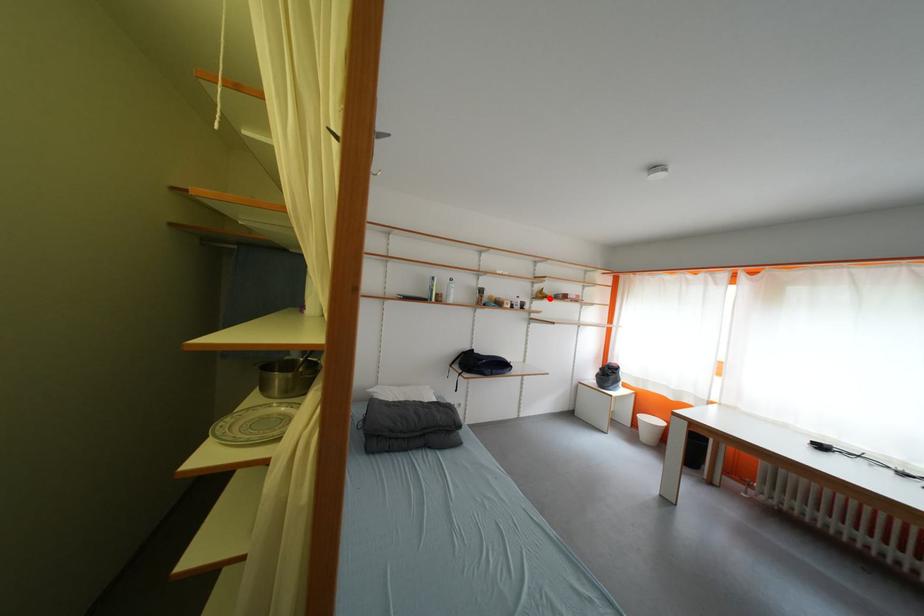
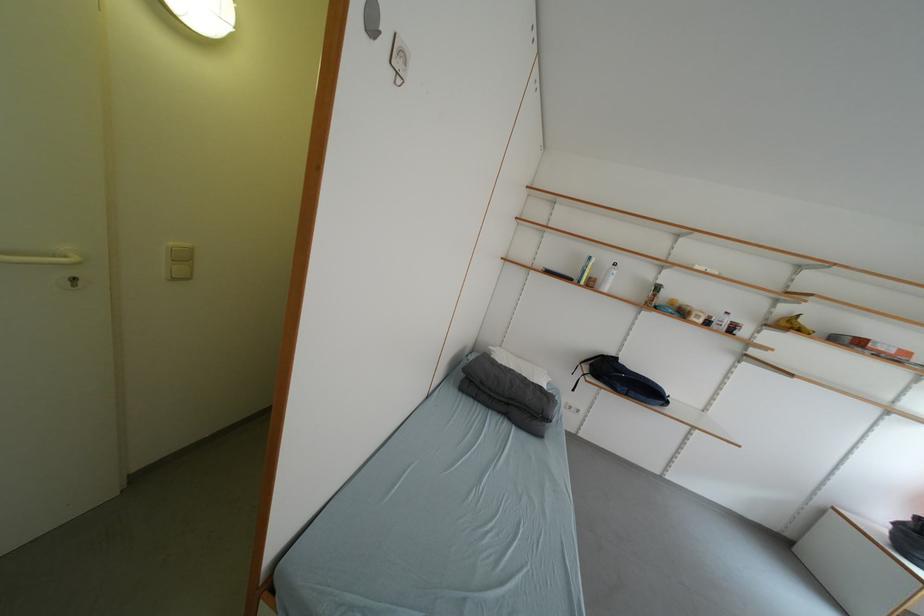
Where in the second image is the point corresponding to the highlighted location from the first image?

(797, 328)